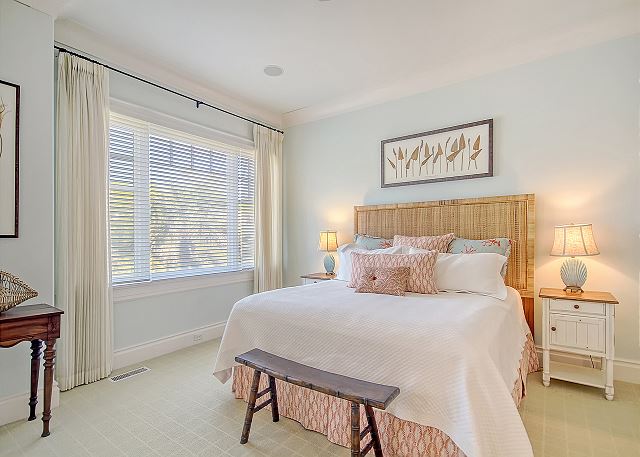
At what (x,y) coordinates should I click in order to perform the action: click on pillows. Please return your answer as a coordinate pair (x, y). This screenshot has width=640, height=457. Looking at the image, I should click on (383, 283), (442, 277), (403, 264), (349, 256), (422, 237), (372, 239), (477, 242).